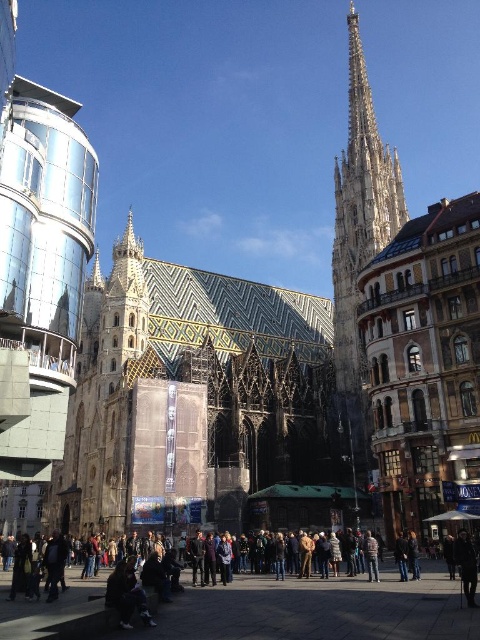
Is dark brown leather jacket at lower center thinner than light brown stone tower at center right?

No, dark brown leather jacket at lower center is not thinner than light brown stone tower at center right.

Which is above, dark brown leather jacket at lower center or light brown stone tower at center right?

light brown stone tower at center right is above.

Who is more distant from viewer, (227, 586) or (343, 298)?

Point (343, 298)

The image size is (480, 640). I want to click on dark brown leather jacket at lower center, so click(316, 609).